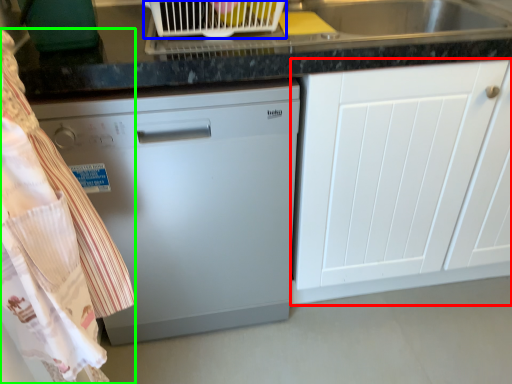
Question: Which is farther away from cabinetry (highlighted by a red box)? appliance (highlighted by a blue box) or laundry (highlighted by a green box)?

Choices:
 (A) appliance
 (B) laundry

Answer: (B)